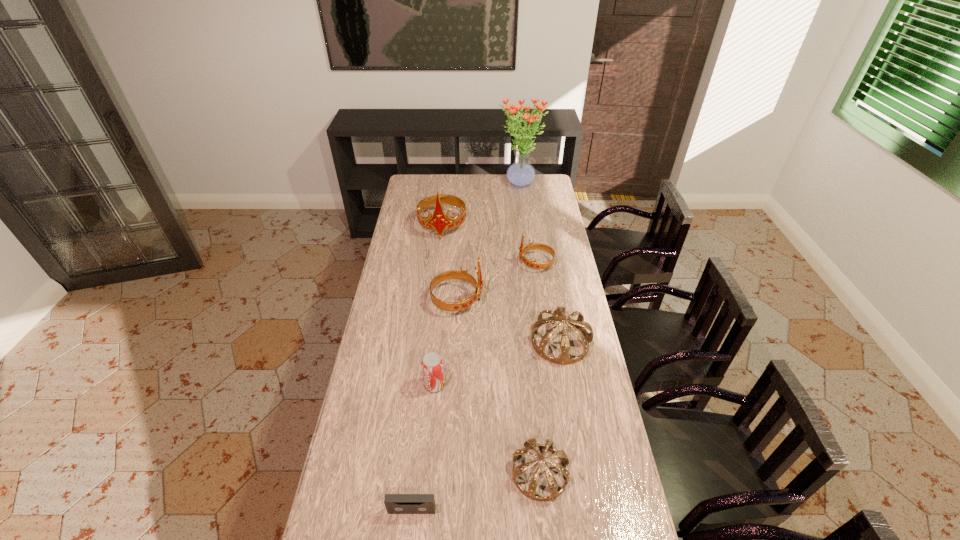
Image resolution: width=960 pixels, height=540 pixels. I want to click on vacant area situated on the front-facing side of the smallest red tiara, so click(x=483, y=264).

In order to click on free space located 0.290m on the front-facing side of the smallest red tiara in this screenshot , I will do `click(455, 264)`.

Locate an element on the screen. The width and height of the screenshot is (960, 540). free spot located 0.310m on the back of the fourth tallest tiara is located at coordinates (548, 269).

At what (x,y) coordinates should I click in order to perform the action: click on vacant space located on the logo side of the red soda can. Please return your answer as a coordinate pair (x, y). Image resolution: width=960 pixels, height=540 pixels. Looking at the image, I should click on (550, 384).

Identify the location of vacant space located on the back of the second nearest object. (529, 363).

At what (x,y) coordinates should I click in order to perform the action: click on object that is at the far edge. Please return your answer as a coordinate pair (x, y). The width and height of the screenshot is (960, 540). Looking at the image, I should click on (520, 174).

Locate an element on the screen. The height and width of the screenshot is (540, 960). object at the left edge is located at coordinates [x=439, y=222].

This screenshot has width=960, height=540. I want to click on flower arrangement that is at the right edge, so click(520, 174).

At what (x,y) coordinates should I click in order to perform the action: click on object located in the far right corner section of the desktop. Please return your answer as a coordinate pair (x, y). The image size is (960, 540). Looking at the image, I should click on (520, 174).

This screenshot has width=960, height=540. Find the location of `vacant space at the far edge of the desktop`. vacant space at the far edge of the desktop is located at coordinates (470, 194).